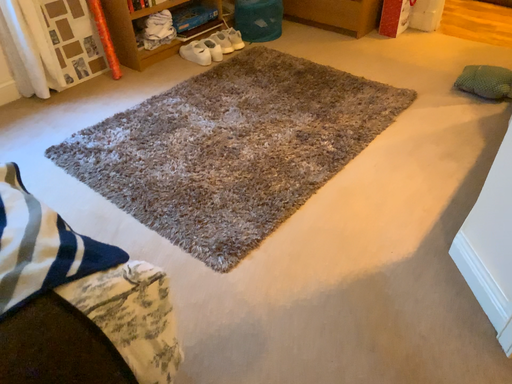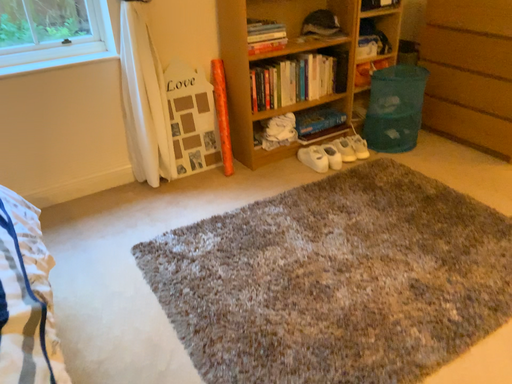
Question: How did the camera likely rotate when shooting the video?

Choices:
 (A) rotated downward
 (B) rotated upward

Answer: (B)